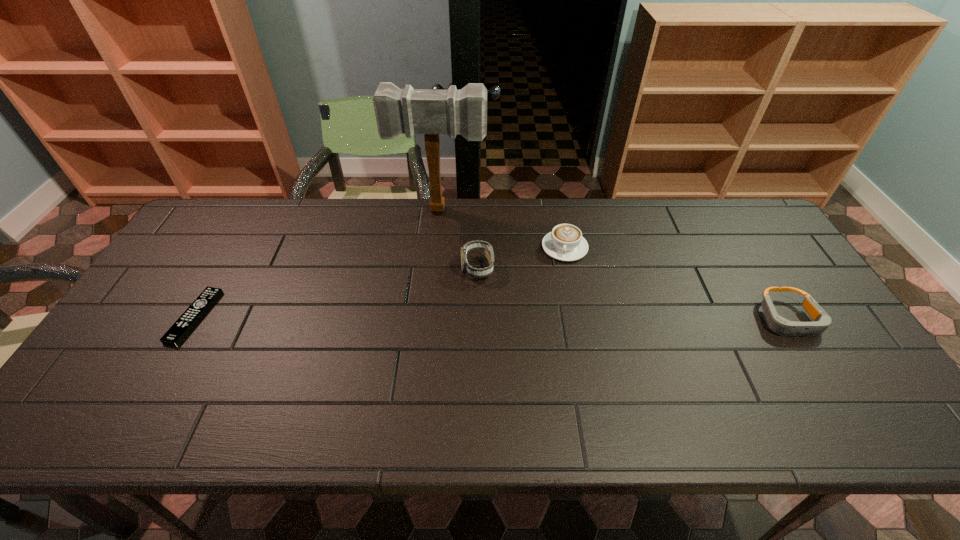
The width and height of the screenshot is (960, 540). I want to click on the shortest object, so click(188, 320).

Where is `remote control`? remote control is located at coordinates (188, 320).

Locate an element on the screen. the rightmost object is located at coordinates (779, 325).

Where is `the fourth tallest object`? This screenshot has width=960, height=540. the fourth tallest object is located at coordinates (779, 325).

Where is `the farthest object`? the farthest object is located at coordinates (431, 112).

Where is `the tallest object`? The image size is (960, 540). the tallest object is located at coordinates (431, 112).

Where is `the fourth shortest object`? This screenshot has width=960, height=540. the fourth shortest object is located at coordinates (483, 245).

This screenshot has width=960, height=540. I want to click on cappuccino, so click(565, 243).

I want to click on the second object from right to left, so click(565, 243).

Identify the location of vacant position located on the right of the remote control. (327, 316).